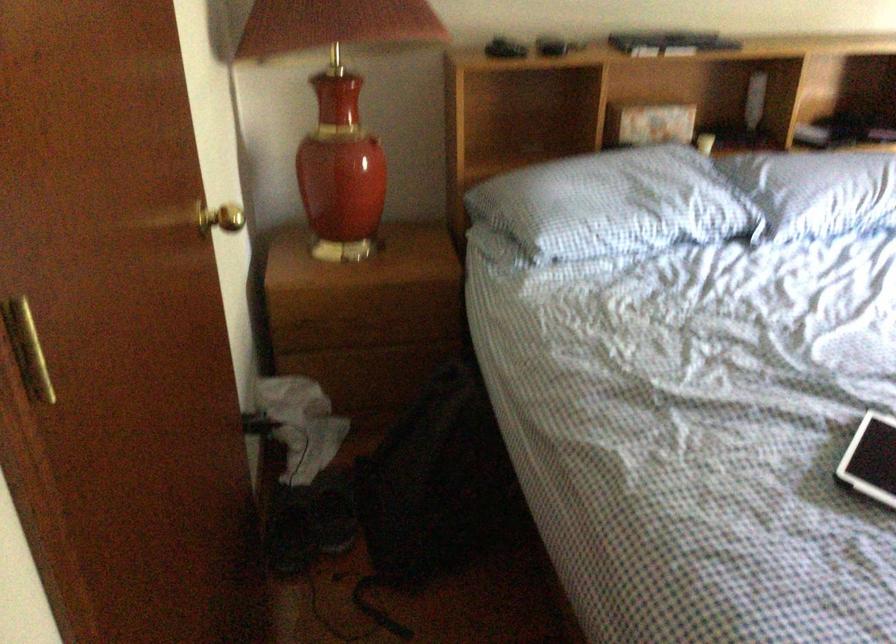
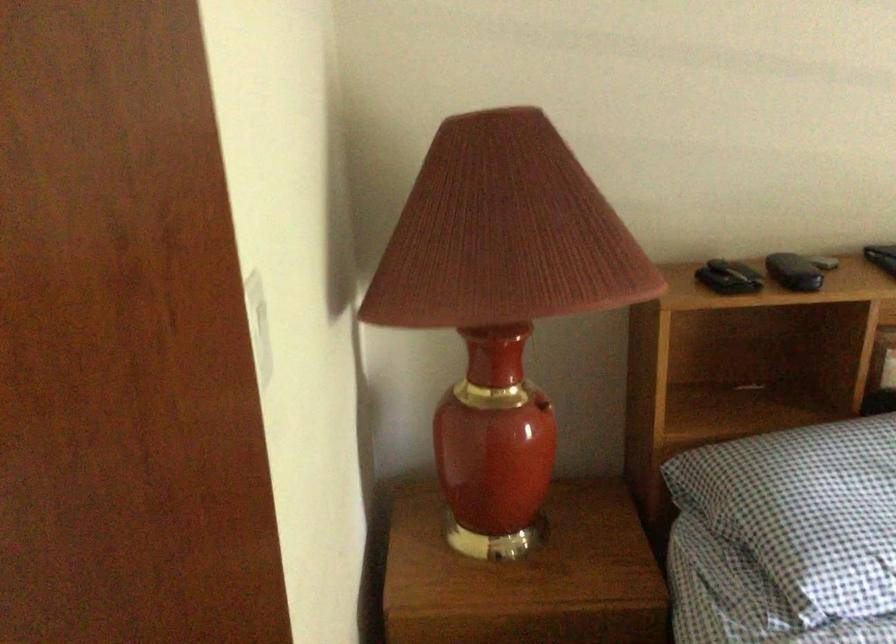
Question: The first image is from the beginning of the video and the second image is from the end. How did the camera likely rotate when shooting the video?

Choices:
 (A) Left
 (B) Right
 (C) Up
 (D) Down

Answer: (C)